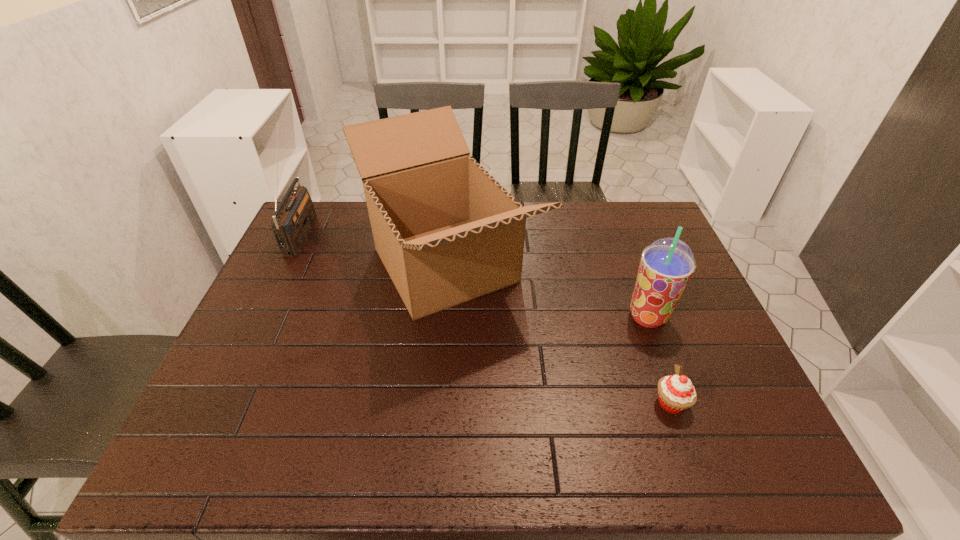
The image size is (960, 540). I want to click on vacant space that is in between the radio receiver and the cupcake, so click(x=487, y=318).

Locate an element on the screen. free space between the radio receiver and the shortest object is located at coordinates (487, 318).

Identify the location of unoccupied area between the smoothie and the box. (546, 291).

The height and width of the screenshot is (540, 960). I want to click on vacant area that lies between the leftmost object and the cupcake, so click(x=487, y=318).

Identify the location of free spot between the radio receiver and the cupcake. (487, 318).

Find the location of a particular element. empty space between the nearest object and the leftmost object is located at coordinates (487, 318).

Find the location of a particular element. This screenshot has height=540, width=960. empty location between the box and the shortest object is located at coordinates (558, 334).

Identify the location of free space between the cupcake and the smoothie. (660, 360).

Identify the location of object that is the closest one to the cupcake. This screenshot has height=540, width=960. (667, 264).

Identify which object is the closest to the leftmost object. Please provide its 2D coordinates. Your answer should be formatted as a tuple, i.e. [(x, y)], where the tuple contains the x and y coordinates of a point satisfying the conditions above.

[(447, 232)]